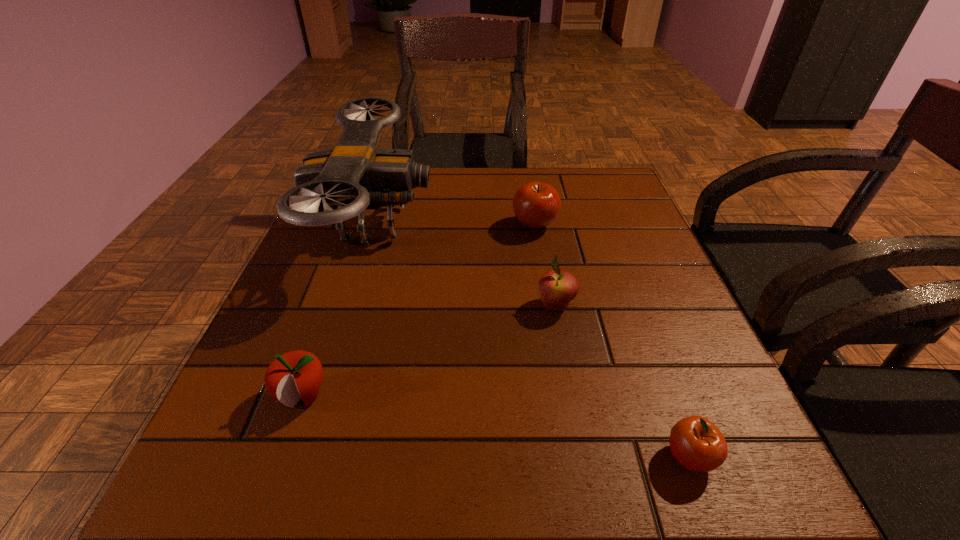
The image size is (960, 540). In order to click on the tallest object in this screenshot , I will do `click(353, 177)`.

Where is `the farthest apple`? This screenshot has height=540, width=960. the farthest apple is located at coordinates (536, 205).

Where is `the third nearest apple`? the third nearest apple is located at coordinates (558, 287).

Where is `the third farthest apple`? the third farthest apple is located at coordinates (295, 375).

At what (x,y) coordinates should I click in order to perform the action: click on the fourth farthest object. Please return your answer as a coordinate pair (x, y). Image resolution: width=960 pixels, height=540 pixels. Looking at the image, I should click on (295, 375).

Locate an element on the screen. The width and height of the screenshot is (960, 540). the nearest object is located at coordinates (696, 443).

The height and width of the screenshot is (540, 960). I want to click on the nearest apple, so click(x=696, y=443).

Identify the location of vacant space positioned 0.200m on the front-facing side of the tallest object. (516, 225).

What are the coordinates of `blank space located 0.110m on the front of the farthest apple` in the screenshot? It's located at (541, 269).

At what (x,y) coordinates should I click in order to perform the action: click on free spot located 0.150m on the left of the third nearest apple. Please return your answer as a coordinate pair (x, y). Image resolution: width=960 pixels, height=540 pixels. Looking at the image, I should click on (x=459, y=306).